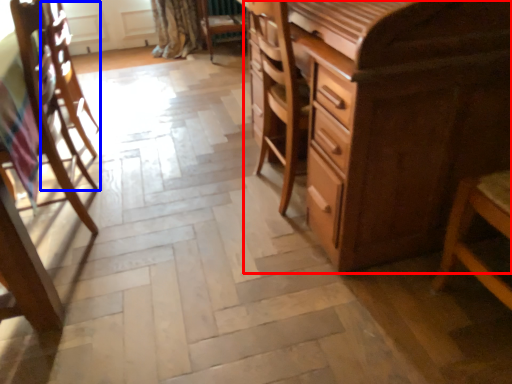
Question: Which object appears farthest to the camera in this image, chest of drawers (highlighted by a red box) or armchair (highlighted by a blue box)?

Choices:
 (A) chest of drawers
 (B) armchair

Answer: (B)